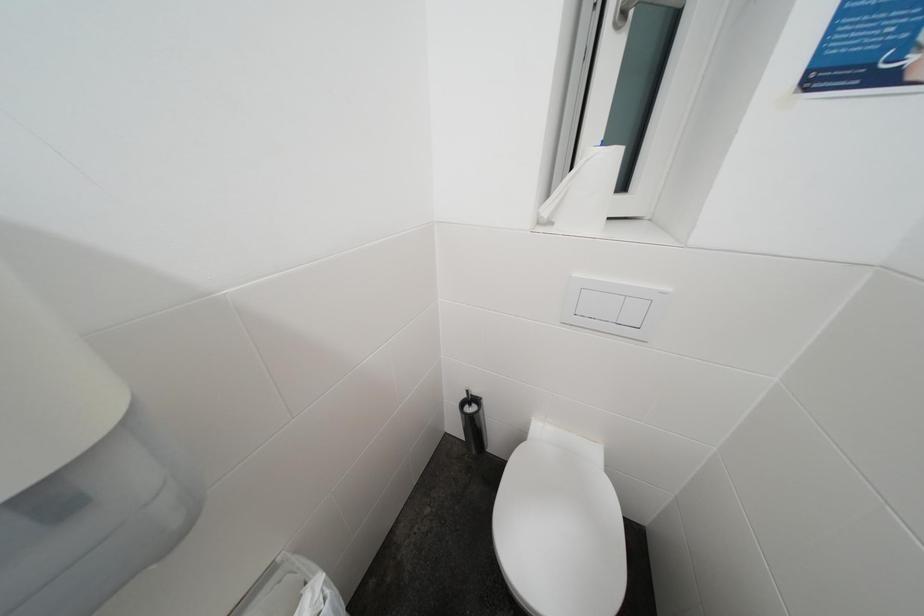
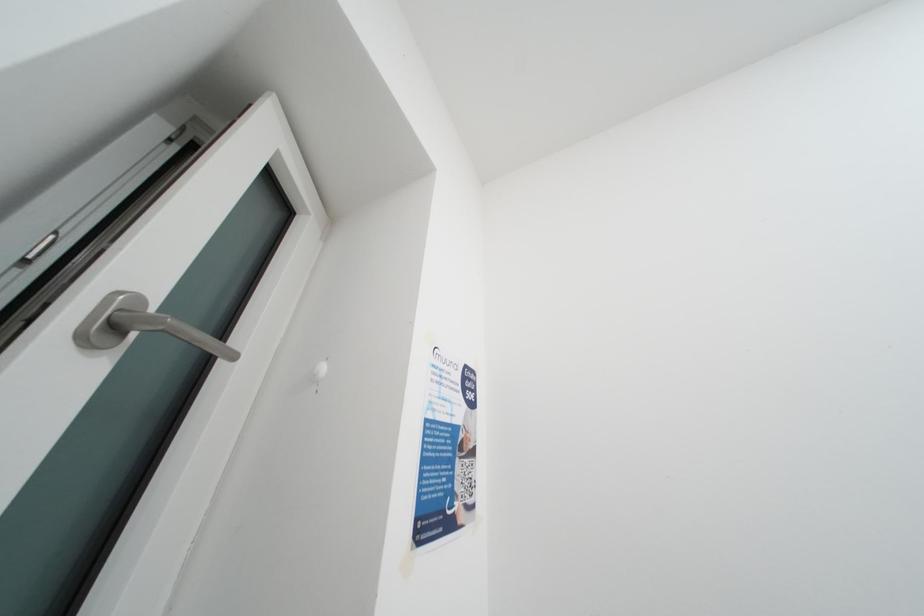
First-person continuous shooting, in which direction is the camera rotating?

The rotation direction of the camera is right-up.